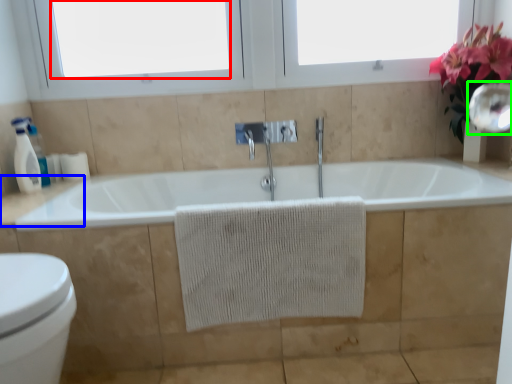
Question: Based on their relative distances, which object is farther from window screen (highlighted by a red box)? Choose from counter top (highlighted by a blue box) and mirror (highlighted by a green box).

Choices:
 (A) counter top
 (B) mirror

Answer: (B)